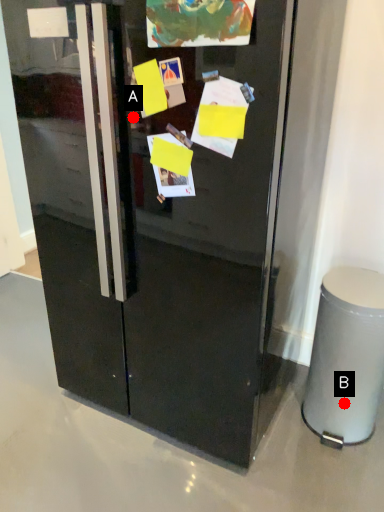
Question: Two points are circled on the image, labeled by A and B beside each circle. Which point appears farthest from the camera in this image?

Choices:
 (A) A is further
 (B) B is further

Answer: (B)